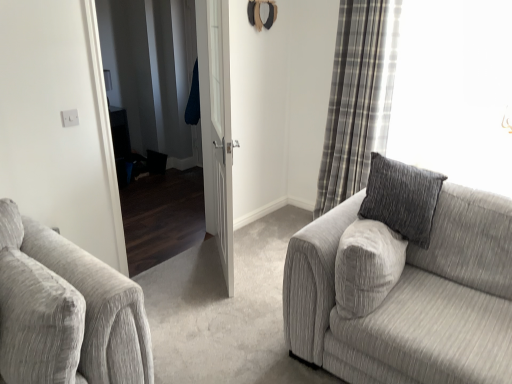
Question: Can you confirm if white wooden door at center is positioned to the left of plaid fabric curtain at right?

Choices:
 (A) yes
 (B) no

Answer: (A)

Question: Considering the relative positions of white wooden door at center and plaid fabric curtain at right in the image provided, is white wooden door at center to the right of plaid fabric curtain at right from the viewer's perspective?

Choices:
 (A) no
 (B) yes

Answer: (A)

Question: Is white wooden door at center beside plaid fabric curtain at right?

Choices:
 (A) no
 (B) yes

Answer: (A)

Question: Considering the relative sizes of white wooden door at center and plaid fabric curtain at right in the image provided, is white wooden door at center taller than plaid fabric curtain at right?

Choices:
 (A) yes
 (B) no

Answer: (B)

Question: Are white wooden door at center and plaid fabric curtain at right far apart?

Choices:
 (A) no
 (B) yes

Answer: (A)

Question: Can you confirm if white wooden door at center is bigger than plaid fabric curtain at right?

Choices:
 (A) no
 (B) yes

Answer: (A)

Question: Considering the relative sizes of textured gray couch at right and white wooden door at center in the image provided, is textured gray couch at right taller than white wooden door at center?

Choices:
 (A) yes
 (B) no

Answer: (B)

Question: Is textured gray couch at right outside of white wooden door at center?

Choices:
 (A) no
 (B) yes

Answer: (B)

Question: Is textured gray couch at right directly adjacent to white wooden door at center?

Choices:
 (A) yes
 (B) no

Answer: (B)

Question: Is white wooden door at center at the back of textured gray couch at right?

Choices:
 (A) yes
 (B) no

Answer: (B)

Question: Is textured gray couch at right in front of white wooden door at center?

Choices:
 (A) yes
 (B) no

Answer: (A)

Question: Can you confirm if textured gray couch at right is bigger than white wooden door at center?

Choices:
 (A) no
 (B) yes

Answer: (B)

Question: Does plaid fabric curtain at right have a larger size compared to textured gray couch at right?

Choices:
 (A) no
 (B) yes

Answer: (A)